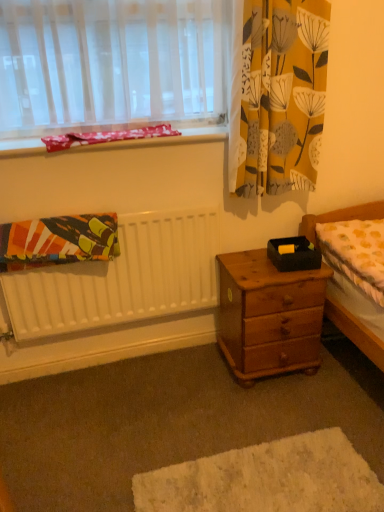
I want to click on vacant area that lies to the right of wooden nightstand at center, so click(348, 382).